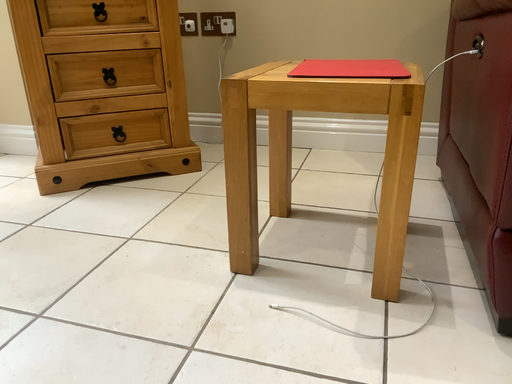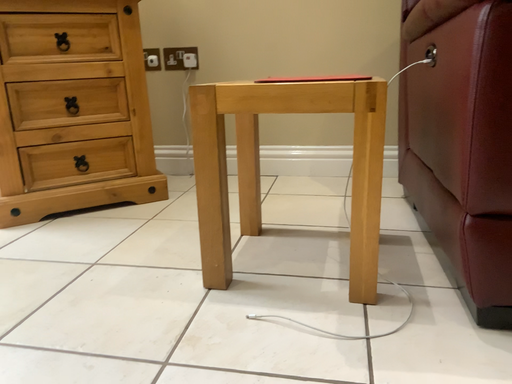
Question: How did the camera likely rotate when shooting the video?

Choices:
 (A) rotated downward
 (B) rotated upward

Answer: (B)